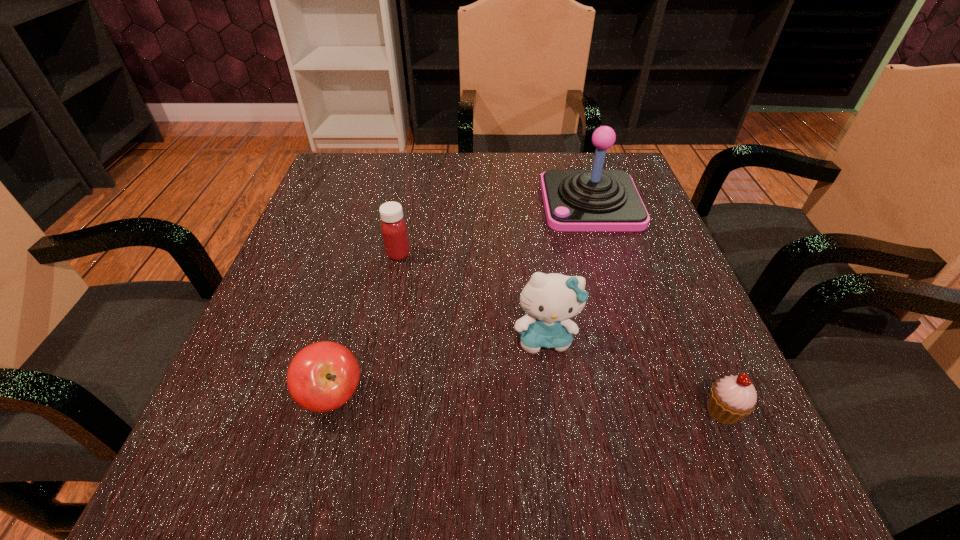
The width and height of the screenshot is (960, 540). Find the location of `free space located on the face of the third farthest object`. free space located on the face of the third farthest object is located at coordinates (562, 461).

You are a GUI agent. You are given a task and a screenshot of the screen. Output one action in this format:
    pyautogui.click(x=<x>, y=<y>)
    Task: Click on the free location located on the right of the fourth nearest object
    This screenshot has height=540, width=960.
    Given the screenshot: What is the action you would take?
    click(x=436, y=254)

The image size is (960, 540). I want to click on free spot located on the right of the apple, so click(572, 395).

The image size is (960, 540). In order to click on vacant area situated on the back of the cupcake in this screenshot , I will do `click(674, 298)`.

This screenshot has width=960, height=540. Identify the location of object that is at the far edge. (575, 200).

Locate an element on the screen. The image size is (960, 540). object that is at the left edge is located at coordinates (x=323, y=376).

Where is `joystick positioned at the right edge`? This screenshot has width=960, height=540. joystick positioned at the right edge is located at coordinates (575, 200).

Where is `cupcake that is at the right edge`? The image size is (960, 540). cupcake that is at the right edge is located at coordinates 732,398.

Where is `object present at the far right corner`? The height and width of the screenshot is (540, 960). object present at the far right corner is located at coordinates tap(575, 200).

You are a GUI agent. You are given a task and a screenshot of the screen. Output one action in this format:
    pyautogui.click(x=<x>, y=<y>)
    Task: Click on the vacant region at the far edge of the desktop
    This screenshot has width=960, height=540.
    Given the screenshot: What is the action you would take?
    pyautogui.click(x=524, y=202)